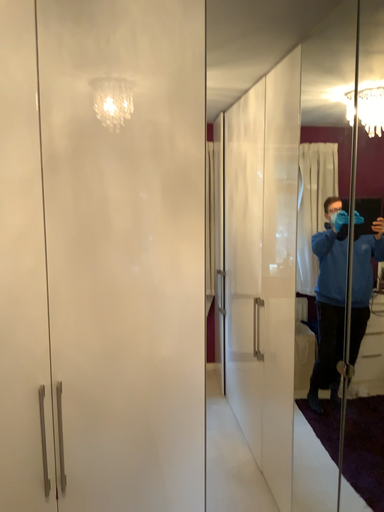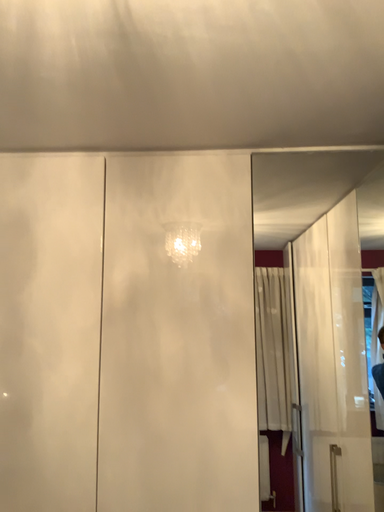
Question: Which way did the camera rotate in the video?

Choices:
 (A) rotated right
 (B) rotated left

Answer: (B)